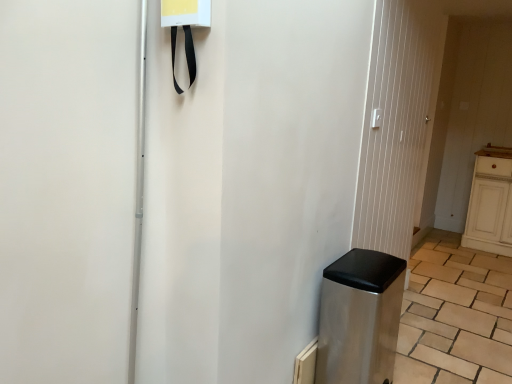
Question: Would you say stainless steel trash can at lower right is to the left or to the right of brown wooden counter top at right in the picture?

Choices:
 (A) right
 (B) left

Answer: (B)

Question: From the image's perspective, is stainless steel trash can at lower right positioned above or below brown wooden counter top at right?

Choices:
 (A) below
 (B) above

Answer: (A)

Question: Estimate the real-world distances between objects in this image. Which object is farther from the brown wooden counter top at right?

Choices:
 (A) stainless steel trash can at lower right
 (B) metallic silver screen door at center

Answer: (A)

Question: Which object is the closest to the brown wooden counter top at right?

Choices:
 (A) stainless steel trash can at lower right
 (B) metallic silver screen door at center

Answer: (B)